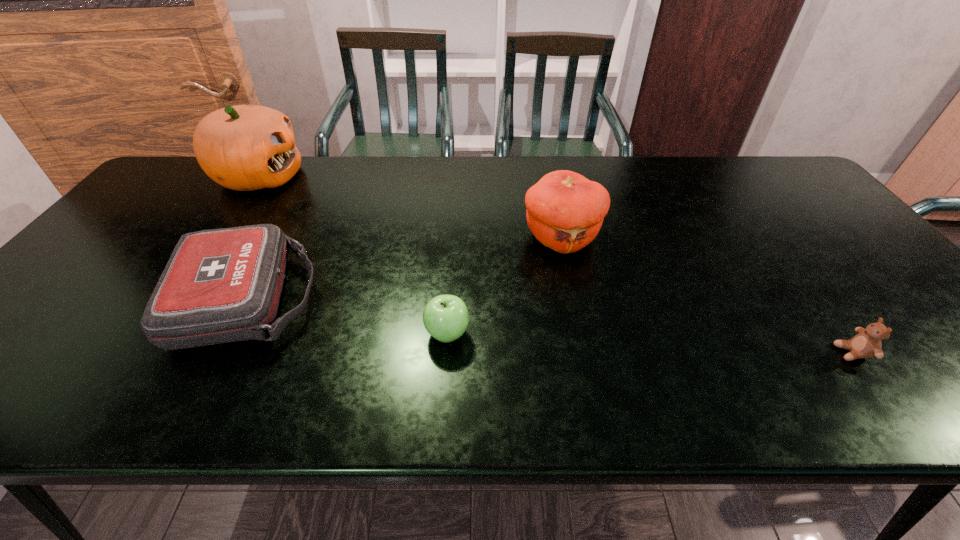
Where is `the farthest object`? the farthest object is located at coordinates (244, 147).

The height and width of the screenshot is (540, 960). What are the coordinates of `the farther pumpkin` in the screenshot? It's located at (244, 147).

Find the location of a particular element. the second object from right to left is located at coordinates (565, 211).

Identify the location of the nearer pumpkin. (565, 211).

The width and height of the screenshot is (960, 540). Identify the location of the first-aid kit. (223, 285).

Find the location of a particular element. The height and width of the screenshot is (540, 960). the third object from left to right is located at coordinates (445, 317).

Identify the location of the rightmost object. The width and height of the screenshot is (960, 540). (867, 343).

Find the location of `vacant space located 0.230m on the face of the left pumpkin`. vacant space located 0.230m on the face of the left pumpkin is located at coordinates (373, 177).

Locate an element on the screen. The width and height of the screenshot is (960, 540). free space located 0.280m on the front of the shorter pumpkin is located at coordinates (586, 352).

I want to click on vacant space located on the front of the first-aid kit, so click(199, 388).